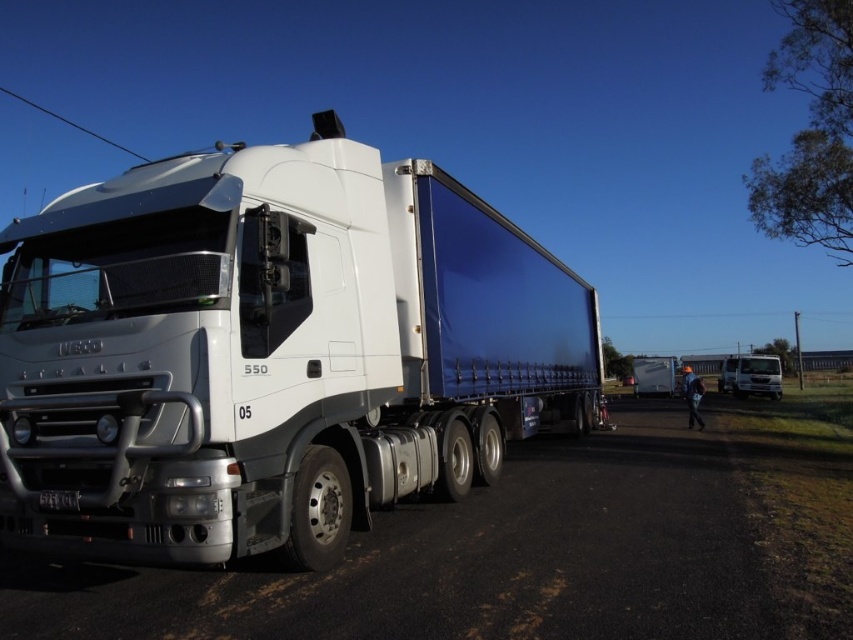
You are a delivery driver planning to park your vehicle in a tight space. You see the white glossy trailer truck at center and the matte blue trailer at center in the parking lot. Which vehicle should you choose to park in the space if you need the one that takes up less area?

You should choose the white glossy trailer truck at center because it occupies less space than the matte blue trailer at center.

Looking at this image, you are standing at point (432,481) and want to walk to the other side of the road. The road is 10 meters wide. Can you safely cross the road without stepping into the truck or its trailer?

The distance between you and the truck is 7.42 meters, which is greater than the road width of 10 meters, so you cannot safely cross the road without stepping into the truck or its trailer.

You are a delivery driver who needs to park your truck in a tight space. You see the white glossy trailer truck at center and the white matte truck at right. Which truck should you choose to fit better in the space?

The white glossy trailer truck at center has a smaller size compared to the white matte truck at right, so it would fit better in the tight parking space.